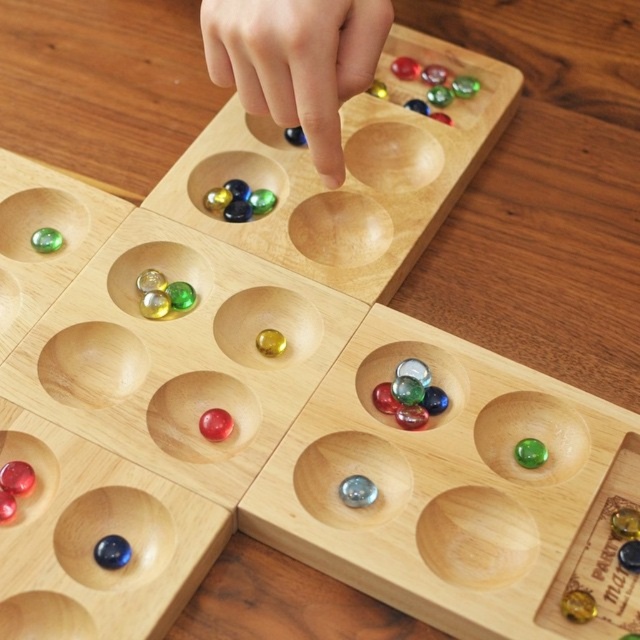
Question: From the image, what is the correct spatial relationship of shiny glass marbles at center in relation to green glass marble at lower right?

Choices:
 (A) left
 (B) right

Answer: (A)

Question: Does translucent glass marbles at center appear under shiny glass marbles at upper center?

Choices:
 (A) no
 (B) yes

Answer: (B)

Question: Does smooth skin hand at upper center have a greater width compared to green glass marble at upper left?

Choices:
 (A) no
 (B) yes

Answer: (B)

Question: Which point is farther to the camera?

Choices:
 (A) smooth skin hand at upper center
 (B) shiny red marble at lower left
 (C) green glass marble at upper left

Answer: (C)

Question: Among these points, which one is farthest from the camera?

Choices:
 (A) coord(403,372)
 (B) coord(220,435)

Answer: (A)

Question: Based on their relative distances, which object is farther from the green glass marble at lower right?

Choices:
 (A) translucent glass marbles at center
 (B) shiny glass marbles at upper center
 (C) translucent glass marbles at center left

Answer: (B)